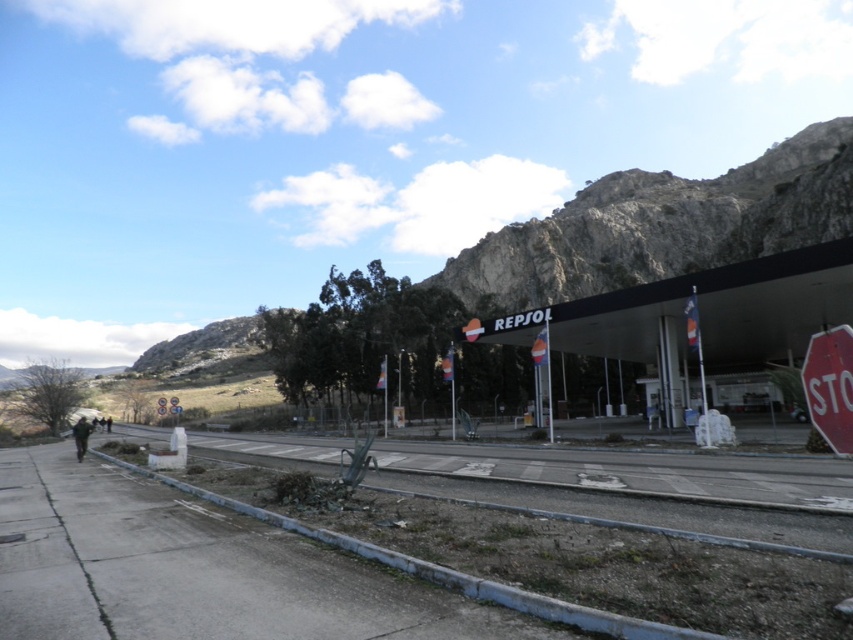
You are a pedestrian approaching the road near the Repsol gas station. You notice a red matte stop sign at lower right and a dark gray jacket at lower left. Which object appears smaller in size?

The red matte stop sign at lower right has a smaller size compared to the dark gray jacket at lower left, so the stop sign appears smaller.

You are a delivery driver who needs to park your vehicle on the gray concrete pavement at lower left. However, there is a dark gray jacket at lower left in the way. Based on the scene description, can you park your vehicle there without moving the jacket?

The gray concrete pavement at lower left is above the dark gray jacket at lower left, meaning the jacket is located underneath the pavement. Since the jacket is beneath the pavement, it cannot obstruct parking, so you can park your vehicle there without moving the jacket.

You are a delivery driver approaching the gray concrete pavement at lower left and the gray concrete train track at lower center. Which one is above the other?

The gray concrete pavement at lower left is positioned over the gray concrete train track at lower center.